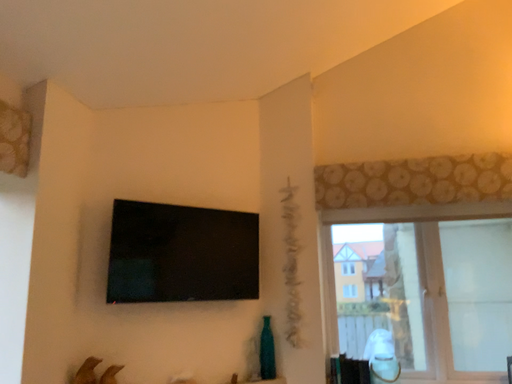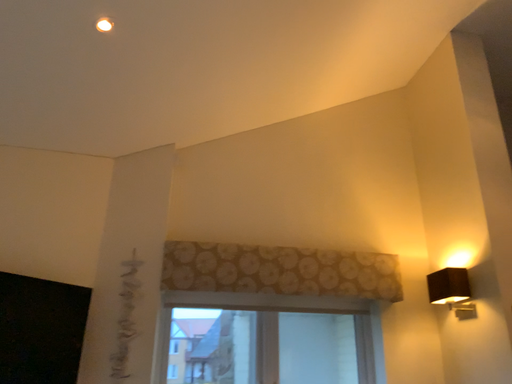
Question: Which way did the camera rotate in the video?

Choices:
 (A) rotated upward
 (B) rotated downward

Answer: (A)